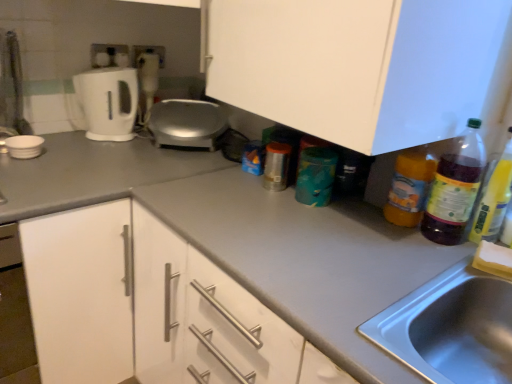
Find the location of a particular element. The height and width of the screenshot is (384, 512). vacant space positioned to the left of translucent plastic bottle at right, placed as the first bottle when sorted from left to right is located at coordinates (342, 218).